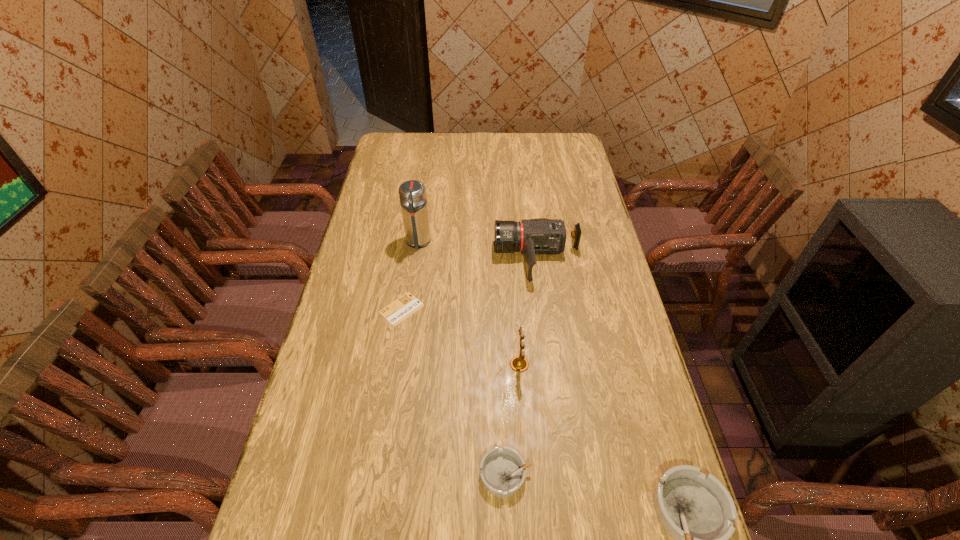
Where is `object that can be found as the closest to the right ashtray`? This screenshot has width=960, height=540. object that can be found as the closest to the right ashtray is located at coordinates (503, 471).

Point out which object is positioned as the third nearest to the third shortest object. Please provide its 2D coordinates. Your answer should be formatted as a tuple, i.e. [(x, y)], where the tuple contains the x and y coordinates of a point satisfying the conditions above.

[(540, 235)]

Where is `blank area in the image that satisfies the following two spatial constraints: 1. with a handle on the side of the shorter ashtray; 2. on the left side of the tallest object`? blank area in the image that satisfies the following two spatial constraints: 1. with a handle on the side of the shorter ashtray; 2. on the left side of the tallest object is located at coordinates (384, 474).

Locate an element on the screen. The width and height of the screenshot is (960, 540). vacant area that satisfies the following two spatial constraints: 1. on the lens of the fourth shortest object; 2. on the front side of the candelabrum is located at coordinates (551, 364).

Where is `blank area in the image that satisfies the following two spatial constraints: 1. on the lens of the fourth shortest object; 2. on the front side of the shortest object`? This screenshot has height=540, width=960. blank area in the image that satisfies the following two spatial constraints: 1. on the lens of the fourth shortest object; 2. on the front side of the shortest object is located at coordinates (543, 309).

I want to click on vacant region that satisfies the following two spatial constraints: 1. with a handle on the side of the candelabrum; 2. on the right side of the tallest object, so click(x=400, y=364).